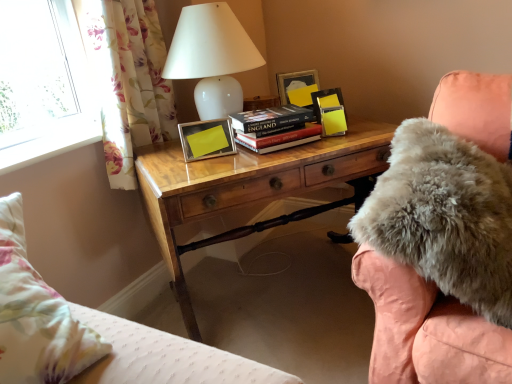
Image resolution: width=512 pixels, height=384 pixels. Identify the location of unoccupied area in front of yellow matte picture frame at upper right, which is counted as the 2th picture frame, starting from the left. (336, 139).